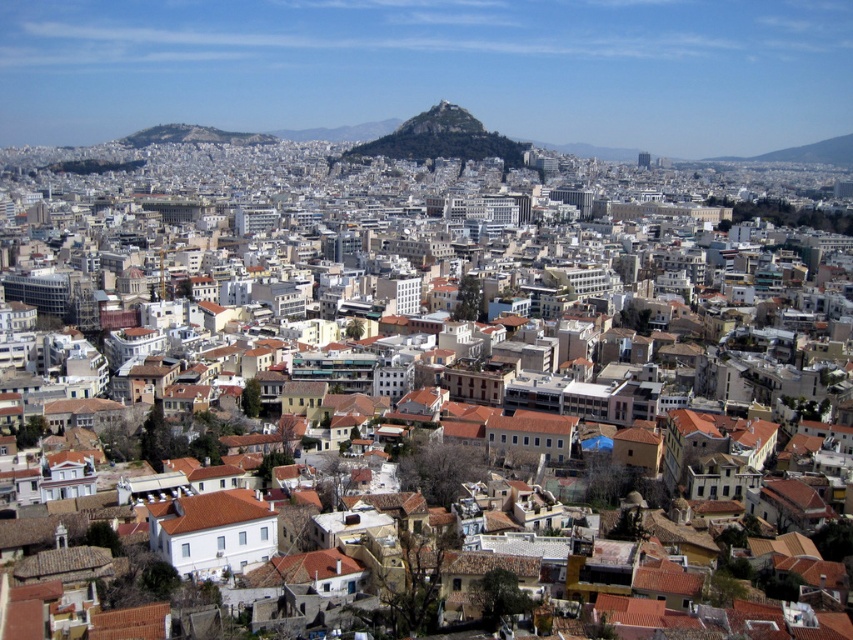
You are a tourist standing at the base of the green grassy hill at center and want to reach the green rocky peak at center. Based on the scene description, which direction should you head to reach the peak?

Since the green grassy hill at center is in front of the green rocky peak at center, you should head towards the direction away from the green grassy hill at center to reach the green rocky peak at center.

You are standing in the urban landscape and want to determine the relative positions of two points marked in the scene. Which point, point (421, 156) or point (412, 116), is closer to you?

Point (421, 156) is closer to you than point (412, 116).

You are a tourist in the city and want to take a photo of both the green grassy hill at center and the green rocky peak at center. Which one should you stand closer to in order to capture both in a single frame?

You should stand closer to the green rocky peak at center because it is shorter than the green grassy hill at center, allowing both to fit within the camera frame when positioned nearer to the shorter object.